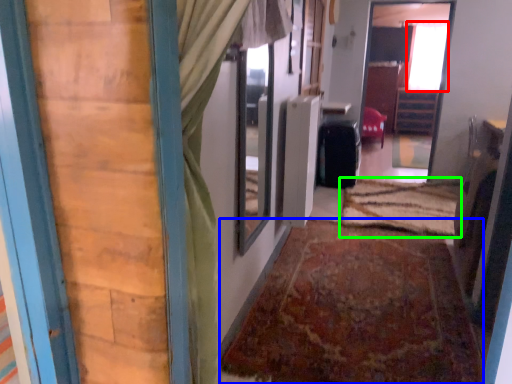
Question: Considering the real-world distances, which object is closest to window (highlighted by a red box)? doormat (highlighted by a blue box) or doormat (highlighted by a green box).

Choices:
 (A) doormat
 (B) doormat

Answer: (B)